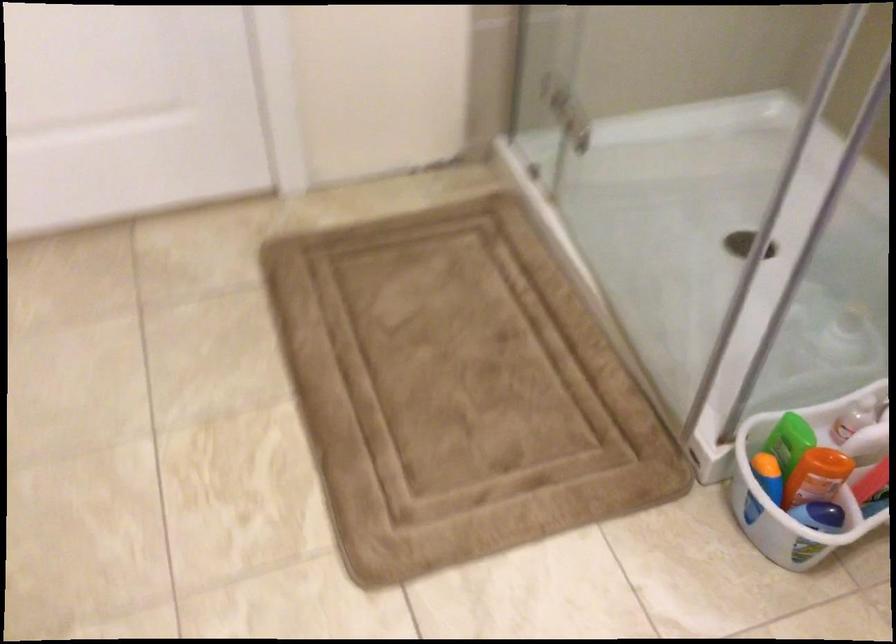
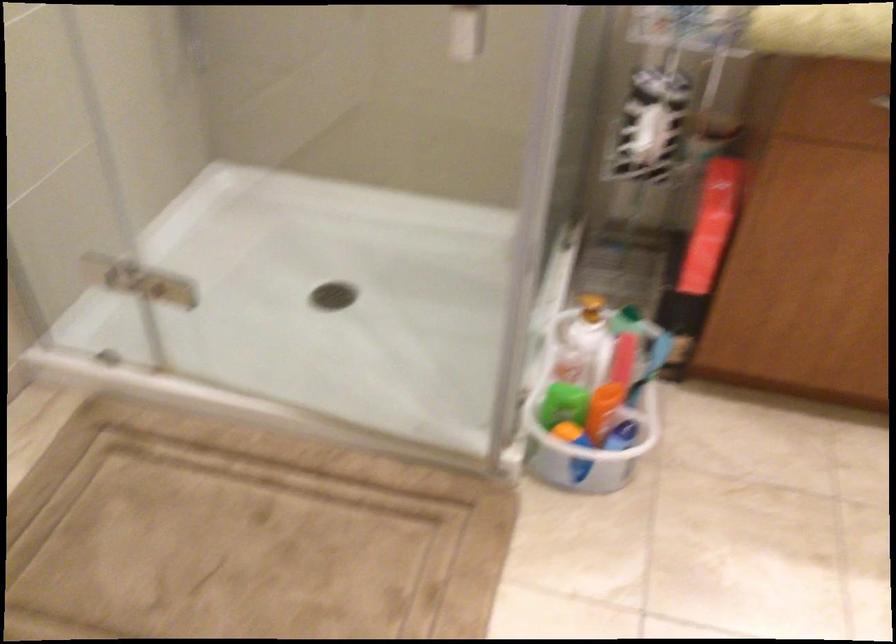
Question: The camera is either moving clockwise (left) or counter-clockwise (right) around the object. The first image is from the beginning of the video and the second image is from the end. Is the camera moving left or right when shooting the video?

Choices:
 (A) Left
 (B) Right

Answer: (A)